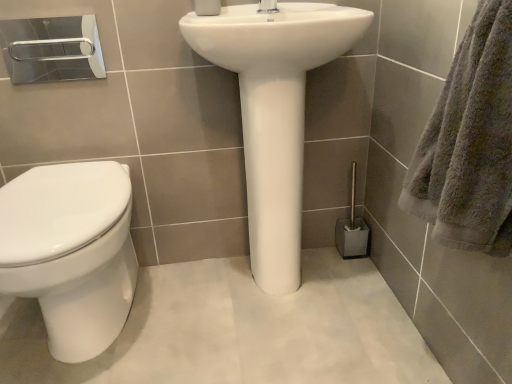
Locate an element on the screen. free spot to the left of metallic silver toilet brush at lower right is located at coordinates (320, 257).